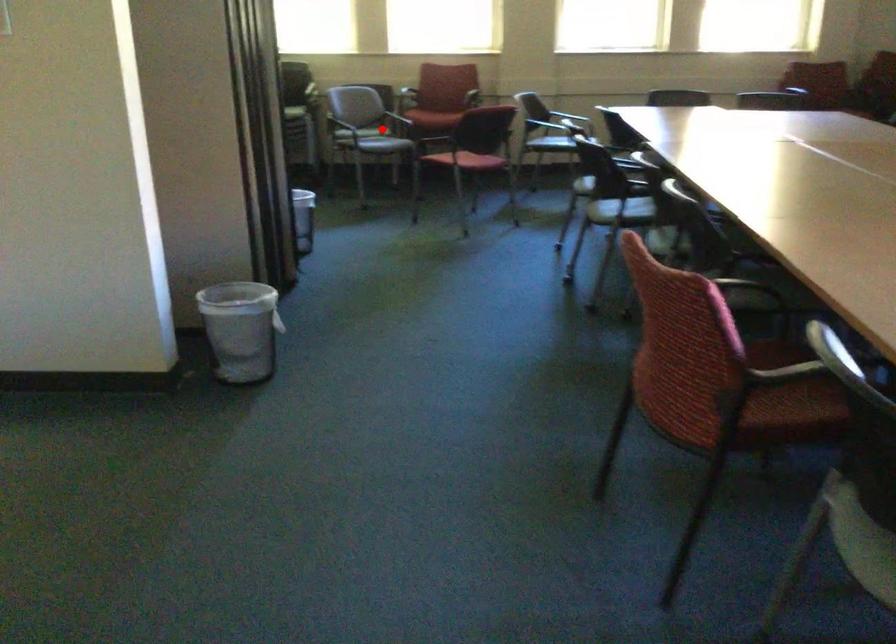
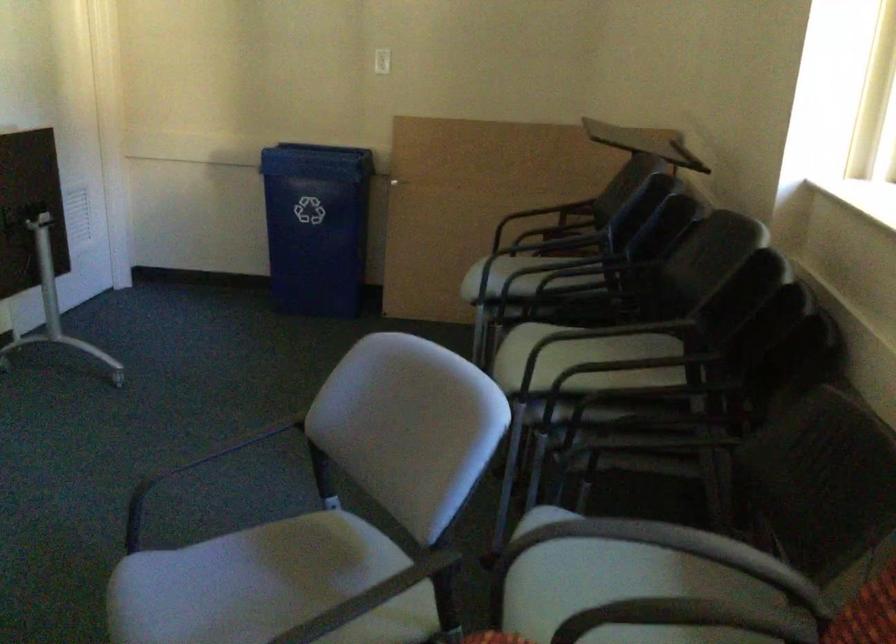
Find the pixel in the second image that matches the highlighted location in the first image.

(586, 564)